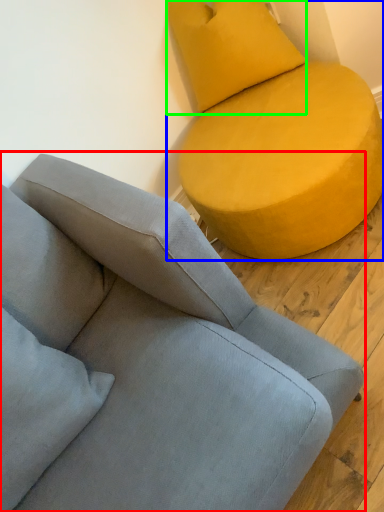
Question: Estimate the real-world distances between objects in this image. Which object is farther from studio couch (highlighted by a red box), studio couch (highlighted by a blue box) or pillow (highlighted by a green box)?

Choices:
 (A) studio couch
 (B) pillow

Answer: (B)